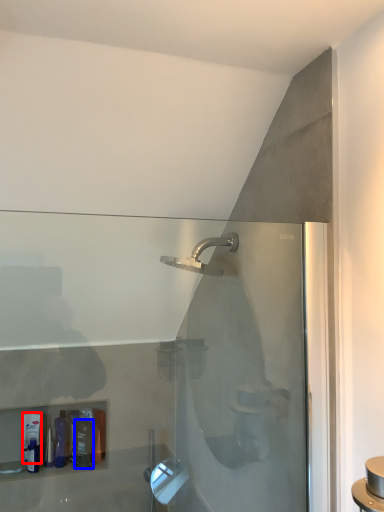
Question: Which of the following is the farthest to the observer, toiletry (highlighted by a red box) or toiletry (highlighted by a blue box)?

Choices:
 (A) toiletry
 (B) toiletry

Answer: (A)